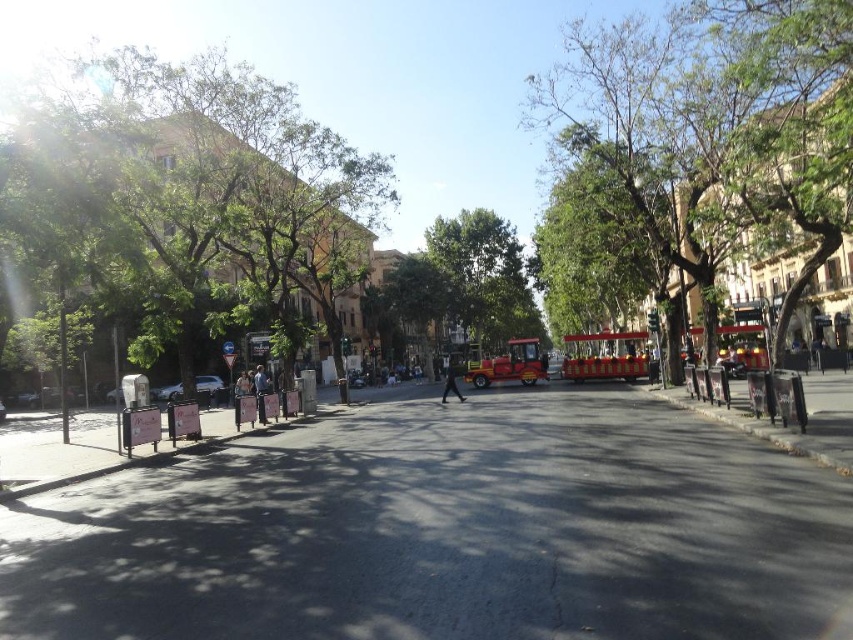
You are a pedestrian standing on the sidewalk near the green leafy tree at left and want to cross the street to reach the red polished bus at center. Which direction should you walk to get closer to the bus?

Since the green leafy tree at left is closer to the viewer than the red polished bus at center, you should walk towards the center of the street to get closer to the red polished bus at center.

You are a delivery person with a cart that is 2 meters wide. You need to move from the asphalt at center to the green leafy tree at center. Is there enough space between them for your cart to pass through?

The asphalt at center and green leafy tree at center are 20.82 meters apart from each other. Since your cart is only 2 meters wide, there is ample space for it to pass through the 20.82 meter gap between them.